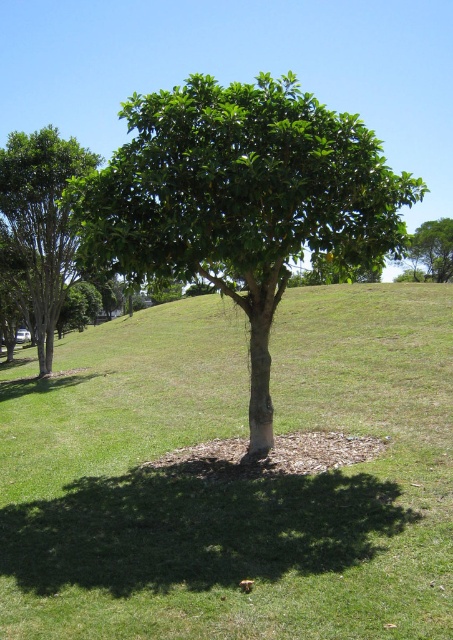
Question: Can you confirm if green grass at center is bigger than green leafy tree at upper center?

Choices:
 (A) no
 (B) yes

Answer: (A)

Question: Does green leafy tree at center have a smaller size compared to green leafy tree at upper center?

Choices:
 (A) no
 (B) yes

Answer: (A)

Question: Considering the real-world distances, which object is closest to the green leafy tree at left?

Choices:
 (A) green leafy tree at center
 (B) green grass at center

Answer: (B)

Question: Which point is closer to the camera?

Choices:
 (A) green leafy tree at upper center
 (B) green leafy tree at left
 (C) green leafy tree at center
 (D) green grass at center

Answer: (D)

Question: Is green leafy tree at center below green leafy tree at left?

Choices:
 (A) yes
 (B) no

Answer: (B)

Question: Which point is closer to the camera taking this photo?

Choices:
 (A) (197, 136)
 (B) (418, 244)

Answer: (A)